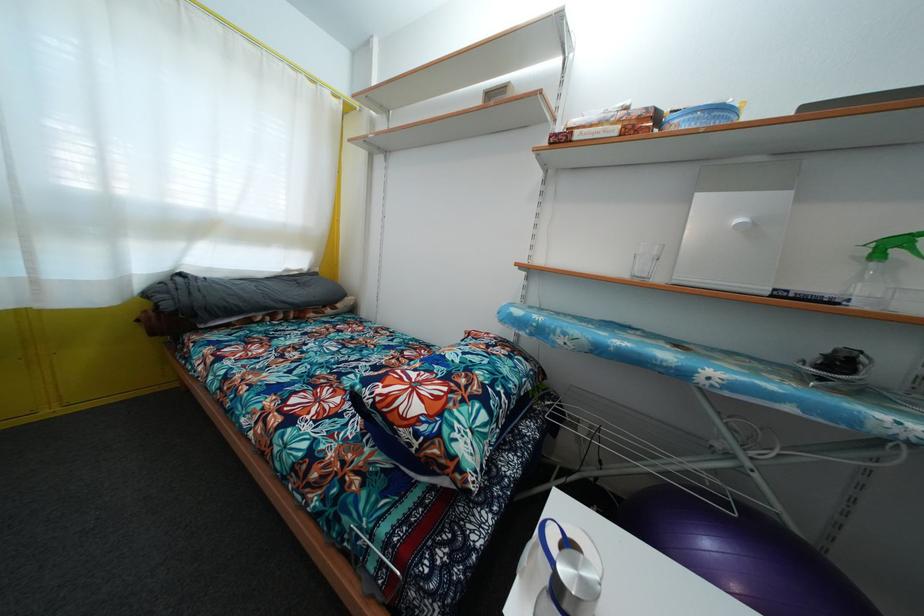
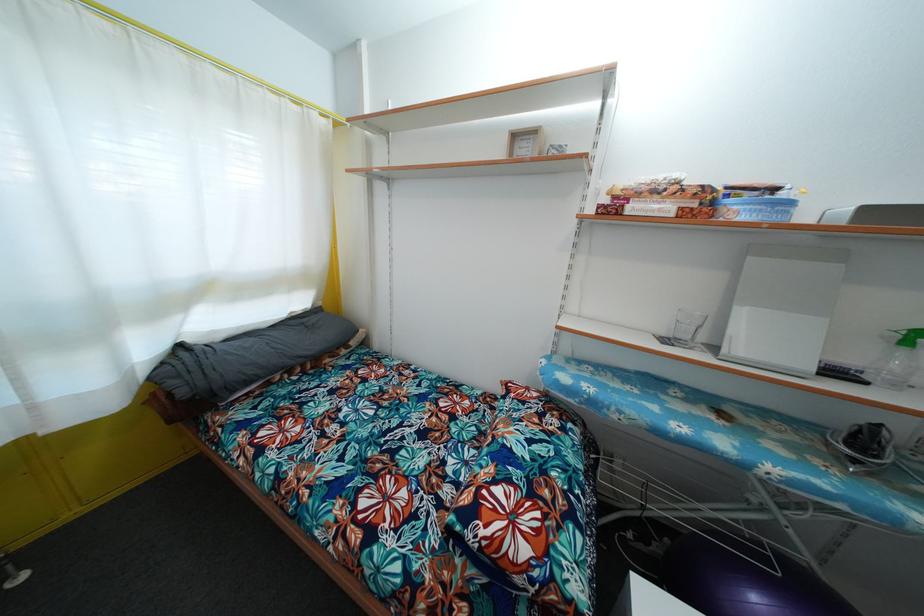
The point at (630, 116) is marked in the first image. Where is the corresponding point in the second image?

(683, 188)